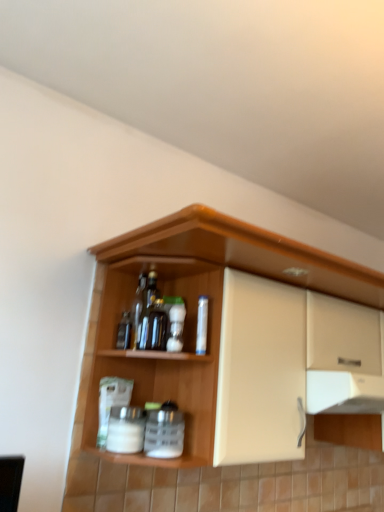
Question: Which is correct: clear plastic bottle at center, the 1th bottle from the right, is inside wooden cabinet at upper center, or outside of it?

Choices:
 (A) outside
 (B) inside

Answer: (B)

Question: Is clear plastic bottle at center, the 1th bottle from the right, in front of or behind wooden cabinet at upper center in the image?

Choices:
 (A) behind
 (B) front

Answer: (A)

Question: Which of these objects is positioned farthest from the wooden cabinet at upper center?

Choices:
 (A) white matte jar at lower center, positioned as the second beverage in right-to-left order
 (B) white plastic spice container at center, which is the second beverage in left-to-right order
 (C) translucent glass bottle at center, acting as the 2th bottle starting from the right
 (D) clear plastic bottle at center, the 1th bottle from the right

Answer: (D)

Question: Considering the real-world distances, which object is farthest from the white plastic spice container at center, which is the second beverage in left-to-right order?

Choices:
 (A) translucent glass bottle at center, acting as the 2th bottle starting from the right
 (B) wooden cabinet at upper center
 (C) clear plastic bottle at center, the 2th bottle viewed from the left
 (D) white matte jar at lower center, arranged as the first beverage when viewed from the left

Answer: (B)